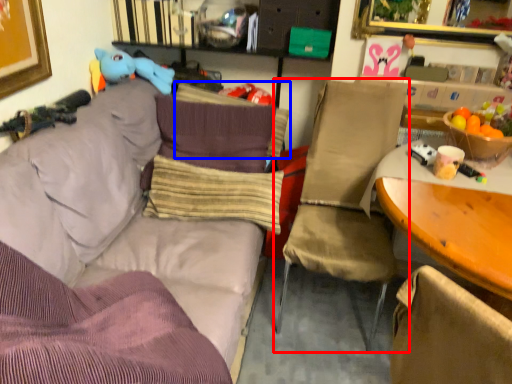
Question: Among these objects, which one is nearest to the camera, chair (highlighted by a red box) or pillow (highlighted by a blue box)?

Choices:
 (A) chair
 (B) pillow

Answer: (A)